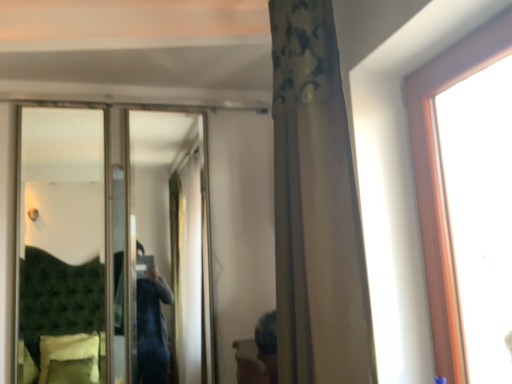
Question: Is metallic silver mirror at center completely or partially outside of white textured curtain at center?

Choices:
 (A) yes
 (B) no

Answer: (A)

Question: Is metallic silver mirror at center touching white textured curtain at center?

Choices:
 (A) yes
 (B) no

Answer: (B)

Question: Is metallic silver mirror at center facing towards white textured curtain at center?

Choices:
 (A) no
 (B) yes

Answer: (B)

Question: Considering the relative sizes of metallic silver mirror at center and white textured curtain at center in the image provided, is metallic silver mirror at center wider than white textured curtain at center?

Choices:
 (A) no
 (B) yes

Answer: (A)

Question: Is metallic silver mirror at center positioned with its back to white textured curtain at center?

Choices:
 (A) no
 (B) yes

Answer: (A)

Question: From the image's perspective, is metallic silver mirror at center below white textured curtain at center?

Choices:
 (A) yes
 (B) no

Answer: (A)

Question: Is the depth of white textured curtain at center less than that of metallic silver mirror at center?

Choices:
 (A) yes
 (B) no

Answer: (A)

Question: Does white textured curtain at center turn towards metallic silver mirror at center?

Choices:
 (A) no
 (B) yes

Answer: (A)

Question: From the image's perspective, is white textured curtain at center on metallic silver mirror at center?

Choices:
 (A) yes
 (B) no

Answer: (A)

Question: Can metallic silver mirror at center be found inside white textured curtain at center?

Choices:
 (A) yes
 (B) no

Answer: (B)

Question: Does white textured curtain at center have a lesser height compared to metallic silver mirror at center?

Choices:
 (A) yes
 (B) no

Answer: (B)

Question: From a real-world perspective, is white textured curtain at center located beneath metallic silver mirror at center?

Choices:
 (A) yes
 (B) no

Answer: (B)

Question: Looking at the image, does metallic silver mirror at center seem bigger or smaller compared to white textured curtain at center?

Choices:
 (A) small
 (B) big

Answer: (A)